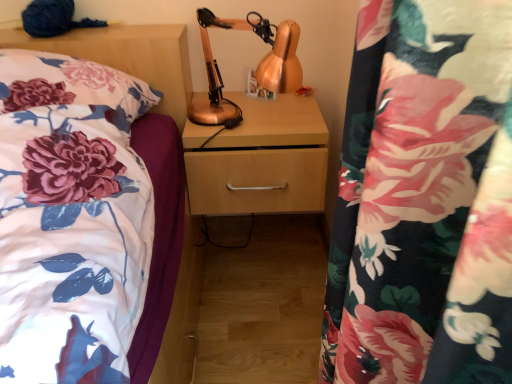
Question: From a real-world perspective, relative to wooden drawer at center, is floral fabric pillow at left vertically above or below?

Choices:
 (A) below
 (B) above

Answer: (B)

Question: In terms of width, does floral fabric pillow at left look wider or thinner when compared to wooden drawer at center?

Choices:
 (A) wide
 (B) thin

Answer: (A)

Question: Which object is positioned farthest from the wooden drawer at center?

Choices:
 (A) floral fabric pillow at left
 (B) copper metallic table lamp at center

Answer: (A)

Question: Based on their relative distances, which object is farther from the wooden drawer at center?

Choices:
 (A) floral fabric pillow at left
 (B) copper metallic table lamp at center

Answer: (A)